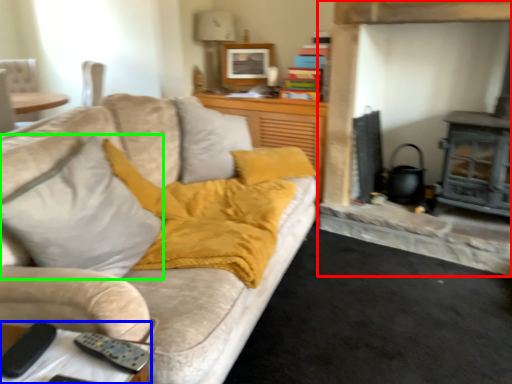
Question: Considering the real-world distances, which object is farthest from fireplace (highlighted by a red box)? table (highlighted by a blue box) or throw pillow (highlighted by a green box)?

Choices:
 (A) table
 (B) throw pillow

Answer: (A)